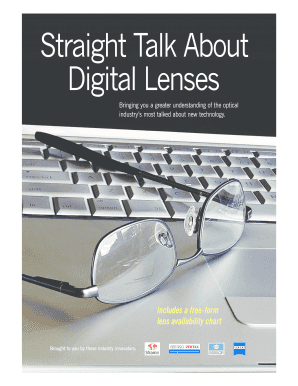
Where is `trackpad`? This screenshot has width=298, height=386. trackpad is located at coordinates (257, 279).